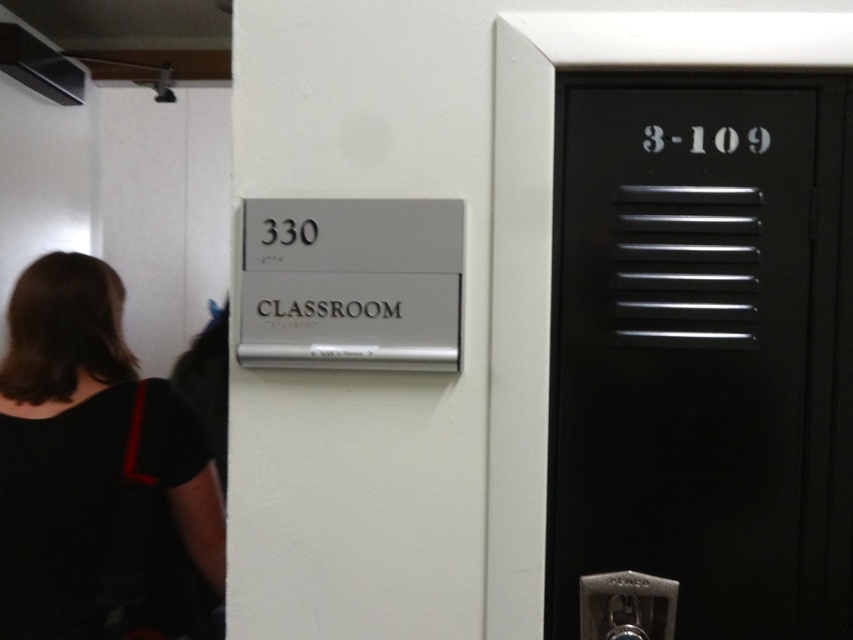
You are standing in front of the wall with the sign and door. There is a point marked at coordinates (96, 470). What is located at this point?

The point at coordinates (96, 470) corresponds to black fabric at left.

You are standing in a hallway and see the black fabric at left and the black metal elevator at right. Which object is closer to the floor?

The black fabric at left is closer to the floor because it is positioned below the black metal elevator at right.

In the scene shown: You are standing in front of the black door with a keypad lock and notice a black fabric at left. Based on their positions, which object is closer to the top edge of the image?

The black fabric at left is closer to the top edge of the image because its 2D location at point (96, 470) places it higher up compared to the black door with keypad lock.